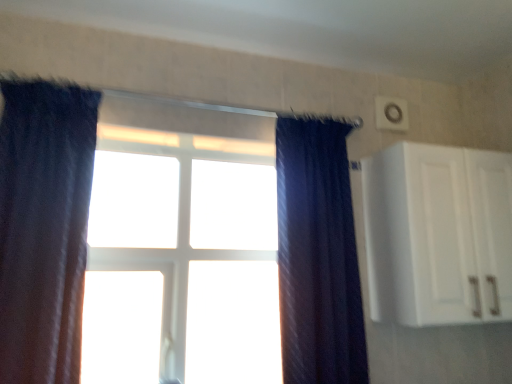
Question: Looking at their shapes, would you say dark blue velvet curtain at left, the 2th curtain from the right, is wider or thinner than dark blue textured curtain at center, the second curtain from the left?

Choices:
 (A) wide
 (B) thin

Answer: (A)

Question: Is dark blue velvet curtain at left, which is the first curtain from left to right, situated inside dark blue textured curtain at center, the second curtain from the left, or outside?

Choices:
 (A) outside
 (B) inside

Answer: (A)

Question: Which is nearer to the dark blue textured curtain at center, acting as the 1th curtain starting from the right?

Choices:
 (A) dark blue velvet curtain at left, the 2th curtain from the right
 (B) white plastic window at center
 (C) white matte cabinet at upper right

Answer: (C)

Question: Which object is positioned farthest from the white plastic window at center?

Choices:
 (A) dark blue velvet curtain at left, which is the first curtain from left to right
 (B) white matte cabinet at upper right
 (C) dark blue textured curtain at center, acting as the 1th curtain starting from the right

Answer: (B)